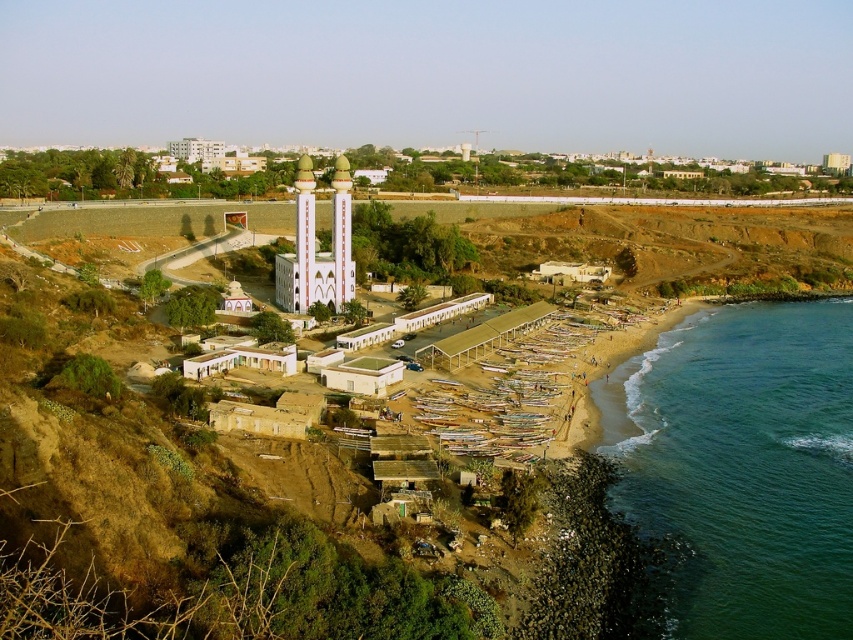
You are standing at the point marked by the coordinates point (741, 467) in the coastal scene. Looking around, you see the white mosque with minarets to the left and the beach with boats to the right. Which direction should you walk to reach the green smooth water at beach right?

The point (741, 467) marks the green smooth water at beach right, so you are already standing on it.

You are a tourist standing on the beach and want to take a photo of the white glossy tower at center without the green smooth water at beach right in the frame. Can you move closer to the tower to achieve this?

The green smooth water at beach right is 238.77 feet away from the white glossy tower at center. If you move closer to the tower, the distance between you and the water will increase, making it harder to exclude the water from the frame. Therefore, moving closer might not help. Instead, moving further back could place the tower and water farther apart in the photo, but since the water is already at the beach right and the tower is at center, adjusting your position to the left might allow you to frame the.